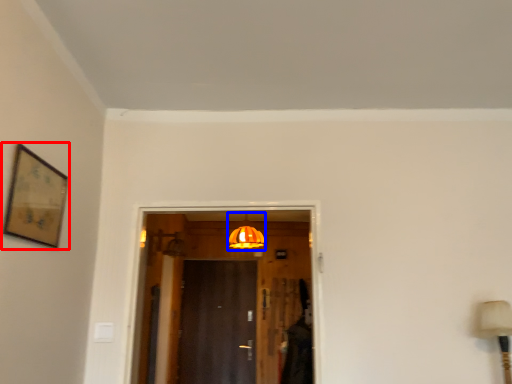
Question: Which of the following is the closest to the observer, picture frame (highlighted by a red box) or light fixture (highlighted by a blue box)?

Choices:
 (A) picture frame
 (B) light fixture

Answer: (A)